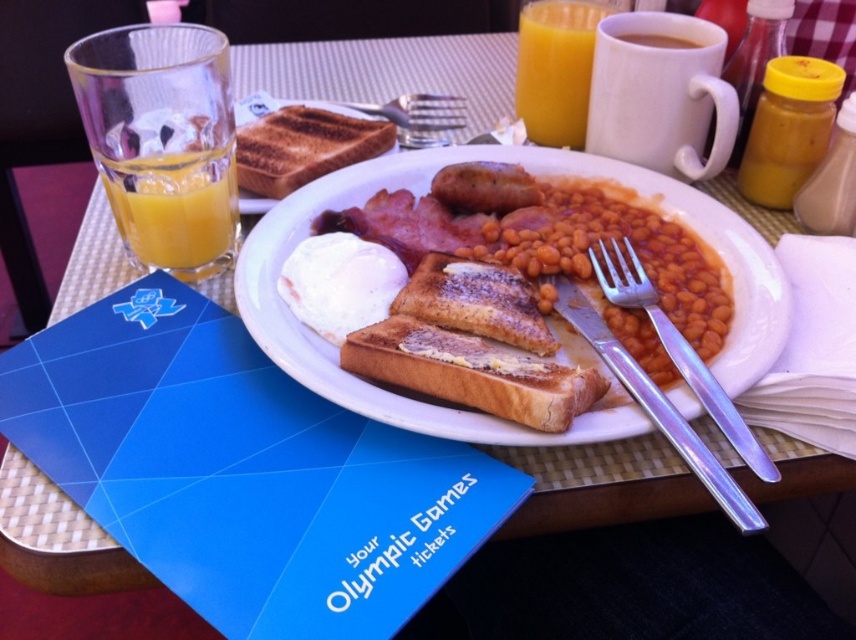
Consider the image. You are a food delivery robot that needs to place a new item on the table. The table is represented by a coordinate system where the bottom left corner is the origin point. The white glazed plate at center is located at point (548, 317). If you want to place the new item 0.1 units to the right of the white glazed plate at center, what would be the coordinate of the new position?

The white glazed plate at center is located at point (548, 317). To place the new item 0.1 units to the right, add 0.1 to the x coordinate. The new coordinate would be 0.597, 0.641.

You are a waiter carrying a tray with a translucent glass at left and a plate with food items. You need to place a napkin between them. How far apart should you position the napkin from each object to maintain the same distance?

The napkin should be placed exactly halfway between the translucent glass at left and the plate with food items, which are 42.53 centimeters apart. This means positioning the napkin 21.265 centimeters from each object.

You are a server checking the table setup. You need to determine if the translucent glass at left can fit into a storage compartment that is the same width as the brown matte coffee cup at upper center. Can it fit?

The translucent glass at left is wider than the brown matte coffee cup at upper center, so it cannot fit into the storage compartment designed for the coffee cup.